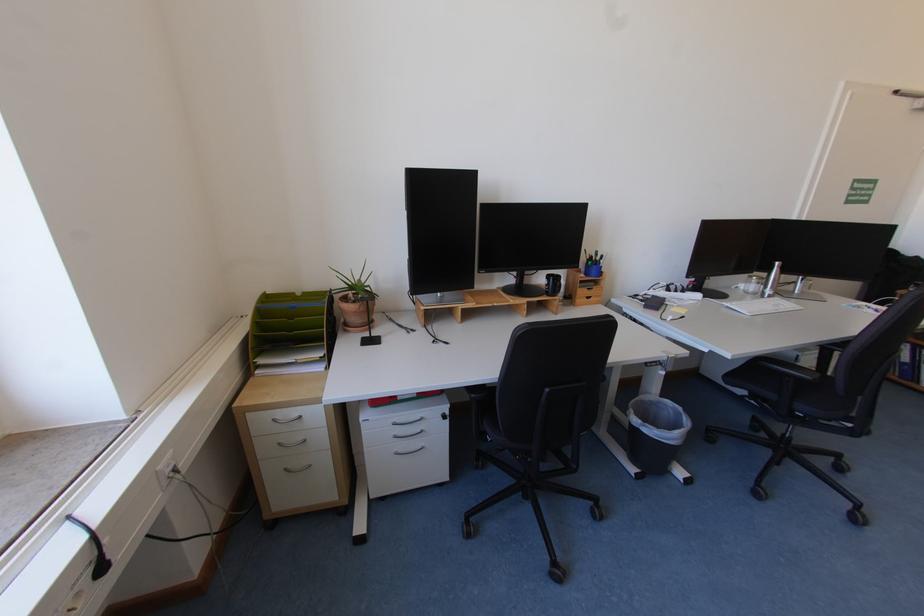
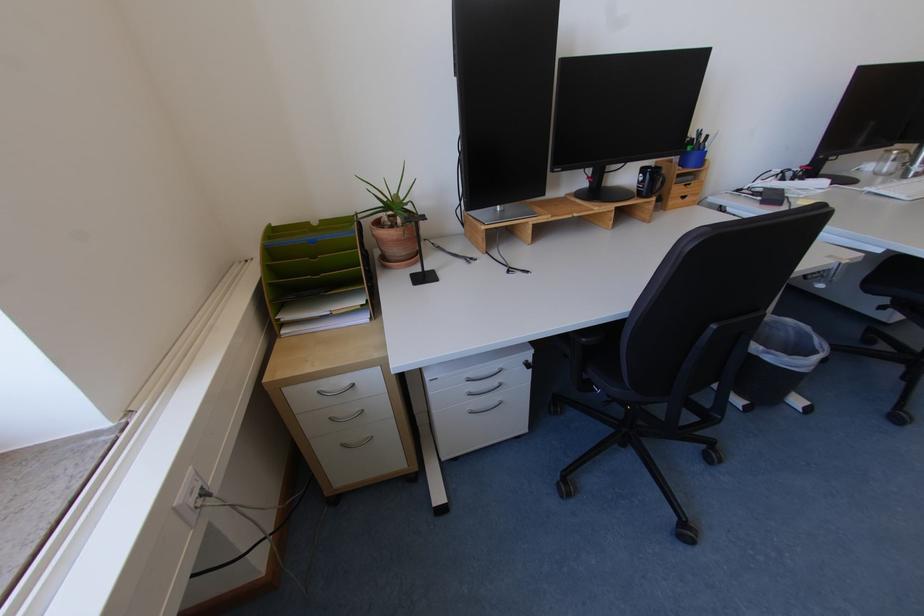
In the second image, find the point that corresponds to (x=294, y=469) in the first image.

(350, 446)